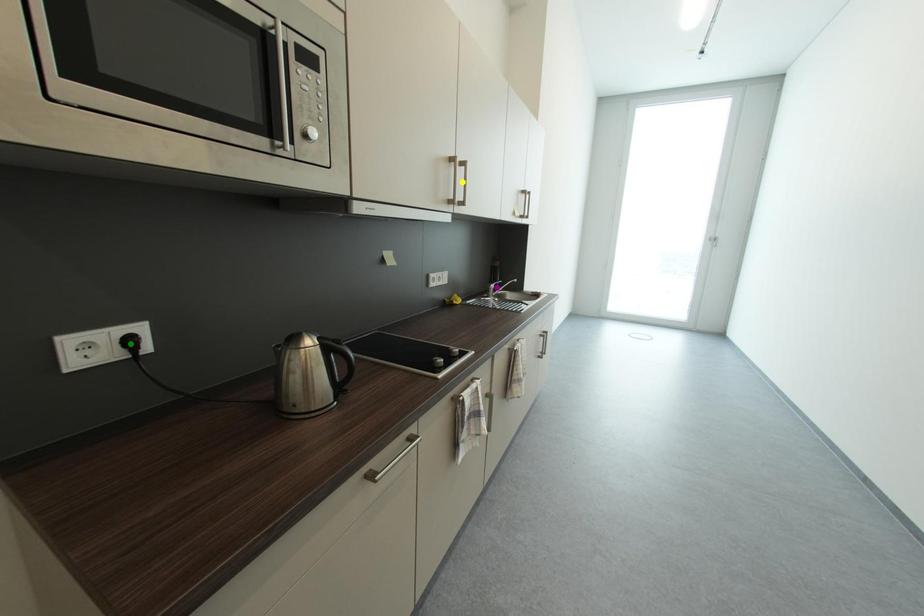
Order these from nearest to farthest:
A) green point
B) yellow point
C) purple point

green point
yellow point
purple point